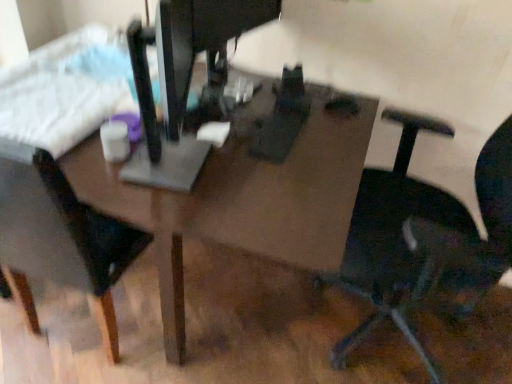
Question: Considering the relative positions of metallic gray sewing machine at center and black plastic chair at right, positioned as the second chair in left-to-right order, in the image provided, is metallic gray sewing machine at center to the left of black plastic chair at right, positioned as the second chair in left-to-right order, from the viewer's perspective?

Choices:
 (A) no
 (B) yes

Answer: (B)

Question: Can you confirm if metallic gray sewing machine at center is smaller than black plastic chair at right, which is the 1th chair from right to left?

Choices:
 (A) yes
 (B) no

Answer: (A)

Question: Is metallic gray sewing machine at center bigger than black plastic chair at right, positioned as the second chair in left-to-right order?

Choices:
 (A) no
 (B) yes

Answer: (A)

Question: Would you say metallic gray sewing machine at center is a long distance from black plastic chair at right, positioned as the second chair in left-to-right order?

Choices:
 (A) yes
 (B) no

Answer: (B)

Question: From the image's perspective, is metallic gray sewing machine at center on black plastic chair at right, which is the 1th chair from right to left?

Choices:
 (A) no
 (B) yes

Answer: (B)

Question: Is metallic gray sewing machine at center directly adjacent to black plastic chair at right, positioned as the second chair in left-to-right order?

Choices:
 (A) yes
 (B) no

Answer: (B)

Question: From the image's perspective, does white plastic keyboard at upper left appear higher than matte brown table at center?

Choices:
 (A) yes
 (B) no

Answer: (A)

Question: Considering the relative sizes of white plastic keyboard at upper left and matte brown table at center in the image provided, is white plastic keyboard at upper left taller than matte brown table at center?

Choices:
 (A) no
 (B) yes

Answer: (A)

Question: From the image's perspective, is white plastic keyboard at upper left under matte brown table at center?

Choices:
 (A) yes
 (B) no

Answer: (B)

Question: Considering the relative positions of white plastic keyboard at upper left and matte brown table at center in the image provided, is white plastic keyboard at upper left to the left of matte brown table at center from the viewer's perspective?

Choices:
 (A) no
 (B) yes

Answer: (B)

Question: Is white plastic keyboard at upper left beside matte brown table at center?

Choices:
 (A) no
 (B) yes

Answer: (A)

Question: Is white plastic keyboard at upper left far away from matte brown table at center?

Choices:
 (A) no
 (B) yes

Answer: (A)

Question: Is the position of black plastic chair at right, which is the 1th chair from right to left, less distant than that of matte brown table at center?

Choices:
 (A) yes
 (B) no

Answer: (A)